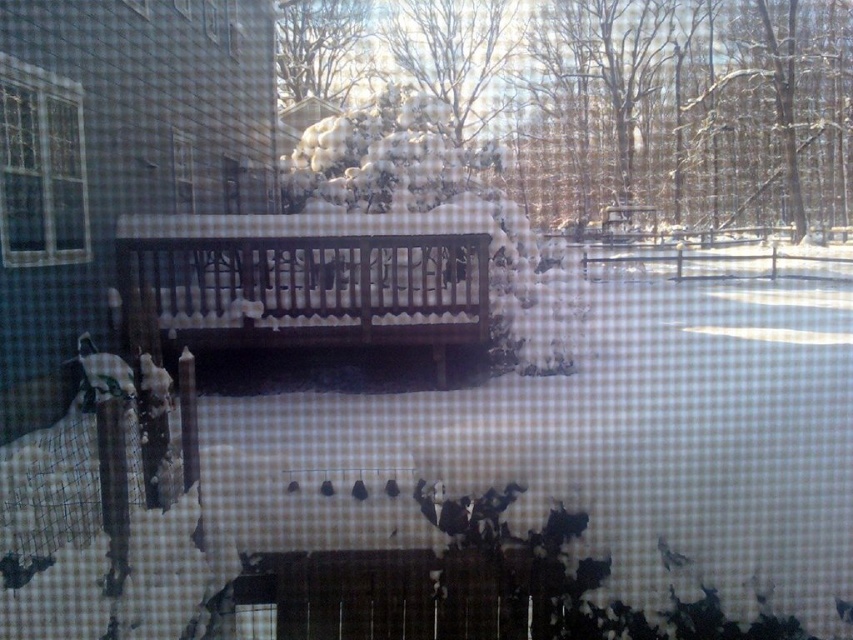
Is white fluffy snow at upper center positioned at the back of clear glass window at upper left?

Yes, it is.

Which is more to the left, white fluffy snow at upper center or clear glass window at upper left?

Positioned to the left is clear glass window at upper left.

Is point (618, 163) positioned in front of point (9, 260)?

No, it is not.

The height and width of the screenshot is (640, 853). Identify the location of white fluffy snow at upper center. (688, 108).

Can you confirm if dark brown wood bench at center is positioned to the right of clear glass window at upper left?

Indeed, dark brown wood bench at center is positioned on the right side of clear glass window at upper left.

Is point (138, 291) positioned behind point (18, 68)?

That is True.

Locate an element on the screen. Image resolution: width=853 pixels, height=640 pixels. dark brown wood bench at center is located at coordinates (305, 282).

Which is in front, point (799, 170) or point (403, 262)?

Positioned in front is point (403, 262).

Can you confirm if white fluffy snow at upper center is positioned to the right of dark brown wood bench at center?

Indeed, white fluffy snow at upper center is positioned on the right side of dark brown wood bench at center.

Does point (401, 32) come farther from viewer compared to point (393, 237)?

Yes, it is behind point (393, 237).

What are the coordinates of `white fluffy snow at upper center` in the screenshot? It's located at (688, 108).